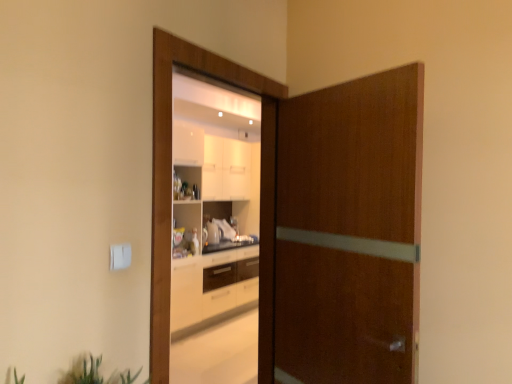
Question: In terms of width, does green leafy plant at lower left look wider or thinner when compared to wooden door at center, marked as the 1th screen door in a left-to-right arrangement?

Choices:
 (A) thin
 (B) wide

Answer: (B)

Question: Considering the positions of green leafy plant at lower left and wooden door at center, which is the 2th screen door in right-to-left order, in the image, is green leafy plant at lower left taller or shorter than wooden door at center, which is the 2th screen door in right-to-left order,?

Choices:
 (A) tall
 (B) short

Answer: (B)

Question: Which is nearer to the green leafy plant at lower left?

Choices:
 (A) wooden door at center, marked as the 1th screen door in a left-to-right arrangement
 (B) brown wood door at center, the first screen door positioned from the right

Answer: (A)

Question: Estimate the real-world distances between objects in this image. Which object is closer to the green leafy plant at lower left?

Choices:
 (A) wooden door at center, which is the 2th screen door in right-to-left order
 (B) brown wood door at center, the 2th screen door viewed from the left

Answer: (A)